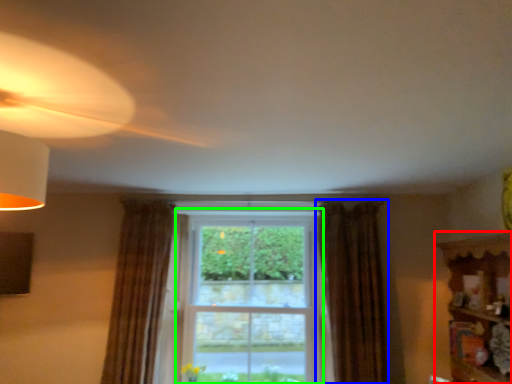
Question: Estimate the real-world distances between objects in this image. Which object is farther from shelf (highlighted by a red box), curtain (highlighted by a blue box) or bay window (highlighted by a green box)?

Choices:
 (A) curtain
 (B) bay window

Answer: (B)